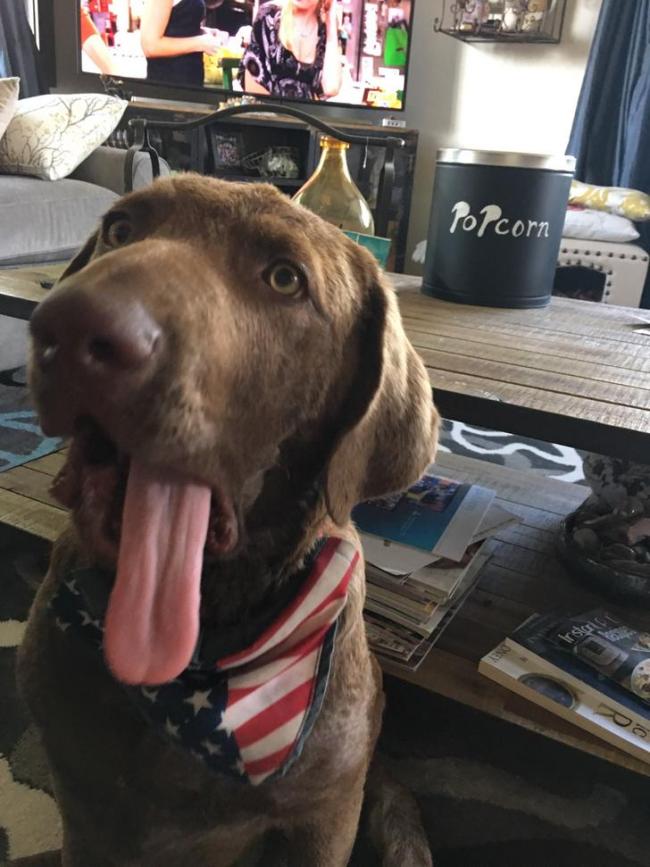
Image resolution: width=650 pixels, height=867 pixels. What are the coordinates of `upper left, bottom of tv` in the screenshot? It's located at (222, 21).